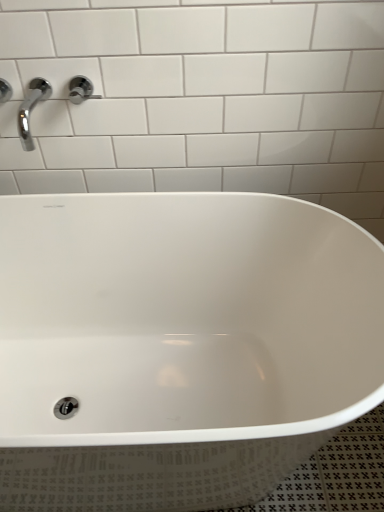
Where is `satin nickel shower handle at upper left`? Image resolution: width=384 pixels, height=512 pixels. satin nickel shower handle at upper left is located at coordinates [81, 90].

The image size is (384, 512). Describe the element at coordinates (81, 90) in the screenshot. I see `satin nickel shower handle at upper left` at that location.

This screenshot has height=512, width=384. I want to click on satin nickel shower handle at upper left, so click(x=81, y=90).